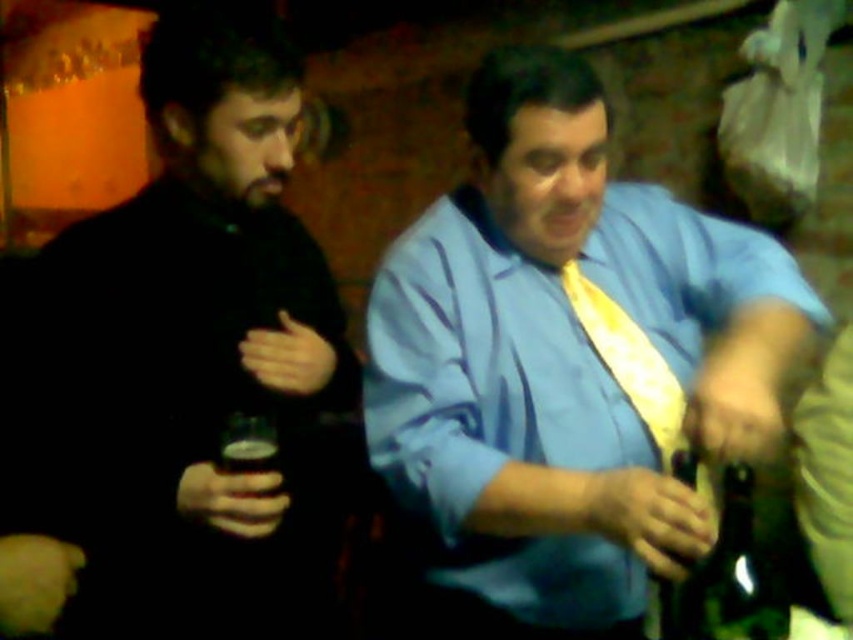
Question: Among these objects, which one is farthest from the camera?

Choices:
 (A) yellow satin tie at center
 (B) black matte shirt at left

Answer: (A)

Question: Observing the image, what is the correct spatial positioning of blue satin shirt at center in reference to yellow satin tie at center?

Choices:
 (A) right
 (B) left

Answer: (B)

Question: Does black matte shirt at left have a lesser width compared to yellow satin tie at center?

Choices:
 (A) no
 (B) yes

Answer: (A)

Question: Which point is closer to the camera?

Choices:
 (A) (186, 113)
 (B) (672, 602)
 (C) (762, 576)
 (D) (618, 355)

Answer: (C)

Question: Which point is farther to the camera?

Choices:
 (A) (428, 353)
 (B) (647, 396)
 (C) (693, 627)

Answer: (B)

Question: Is black matte shirt at left thinner than green glass bottle at lower right?

Choices:
 (A) yes
 (B) no

Answer: (B)